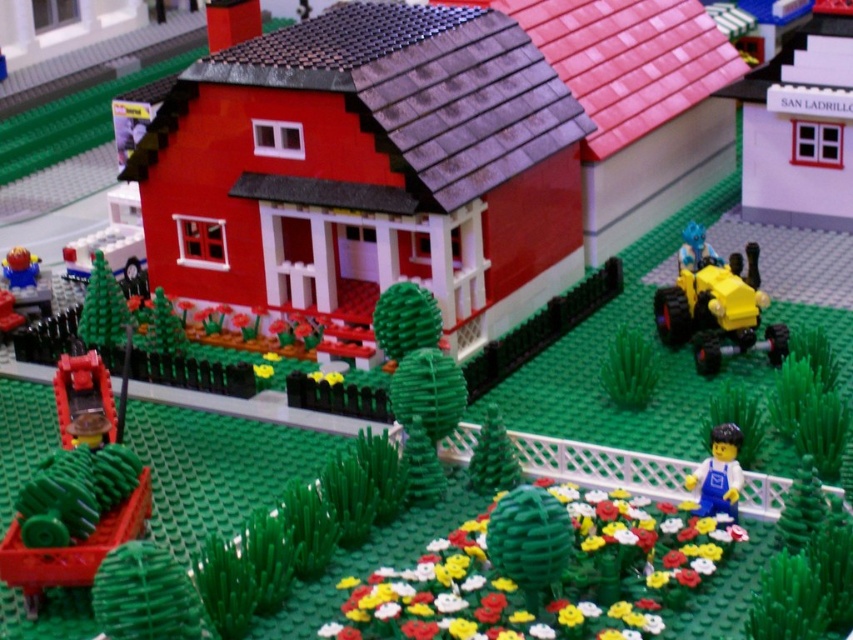
Who is taller, yellow rubber tractor at right or smooth plastic minifigure at lower left?

yellow rubber tractor at right

Does point (749, 333) come behind point (9, 253)?

No, (749, 333) is in front of (9, 253).

Which is behind, point (723, 346) or point (15, 253)?

The point (15, 253) is behind.

Where is `yellow rubber tractor at right`? This screenshot has height=640, width=853. yellow rubber tractor at right is located at coordinates point(715,305).

Does point (697, 280) lie in front of point (733, 484)?

No.

Is point (766, 332) positioned in front of point (730, 458)?

No, (766, 332) is further to viewer.

The image size is (853, 640). I want to click on yellow rubber tractor at right, so click(x=715, y=305).

Is blue overalls figure at lower right to the left of smooth plastic minifigure at lower left from the viewer's perspective?

No, blue overalls figure at lower right is not to the left of smooth plastic minifigure at lower left.

Is point (712, 484) less distant than point (10, 278)?

That is True.

Which is in front, point (722, 444) or point (19, 253)?

Point (722, 444)

This screenshot has width=853, height=640. In order to click on blue overalls figure at lower right in this screenshot , I will do coord(718,474).